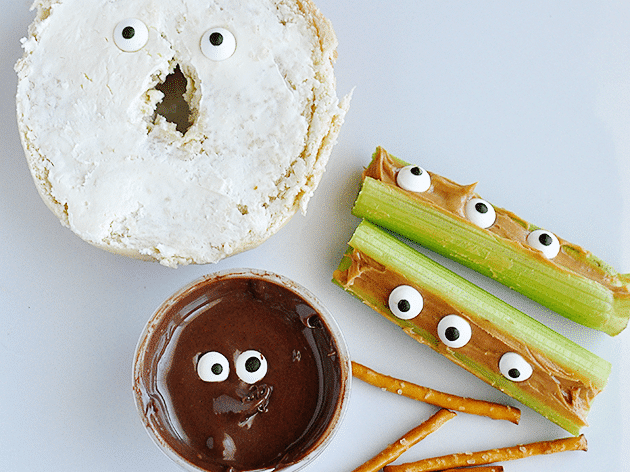
Identify the location of bowl. (331, 321).